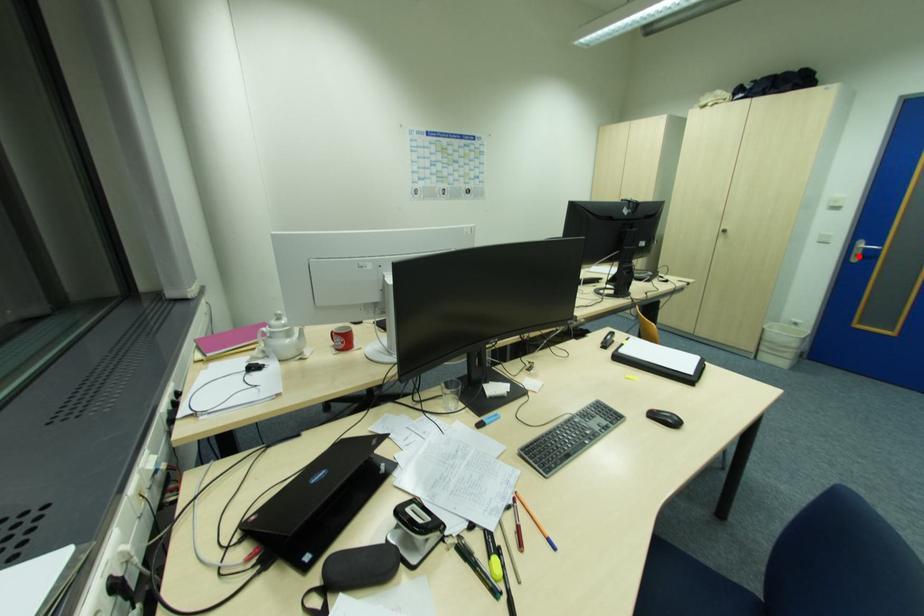
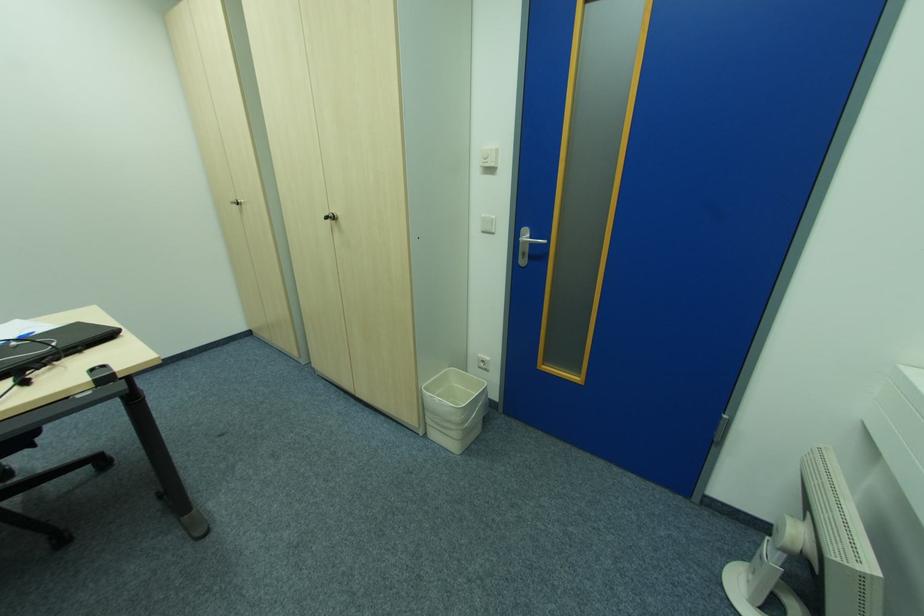
Question: I am providing you with two images of the same scene from different viewpoints. Given a red point in image1, look at the same physical point in image2. Is it:

Choices:
 (A) Closer to the viewpoint
 (B) Farther from the viewpoint

Answer: (A)